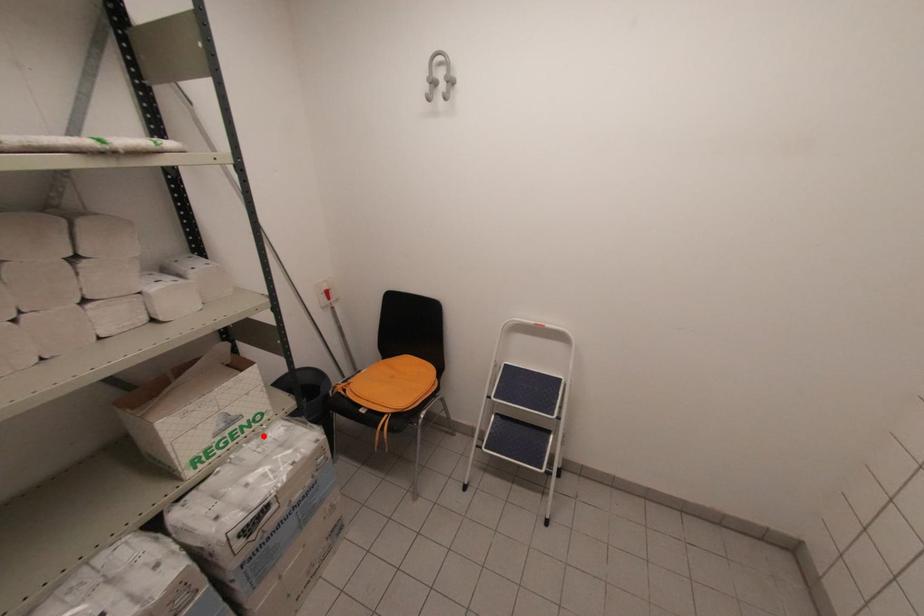
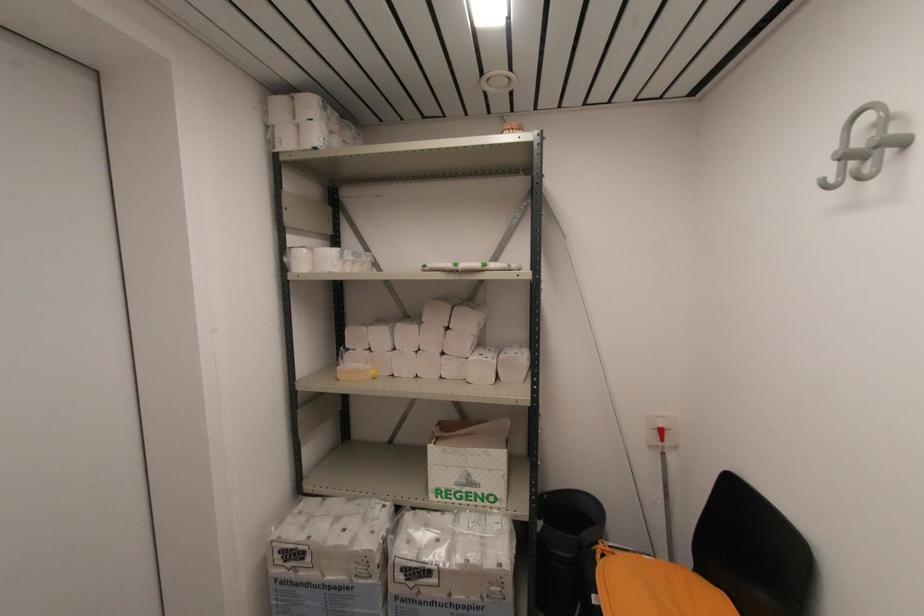
Locate, in the second image, the point that corresponds to the highlighted location in the first image.

(484, 517)